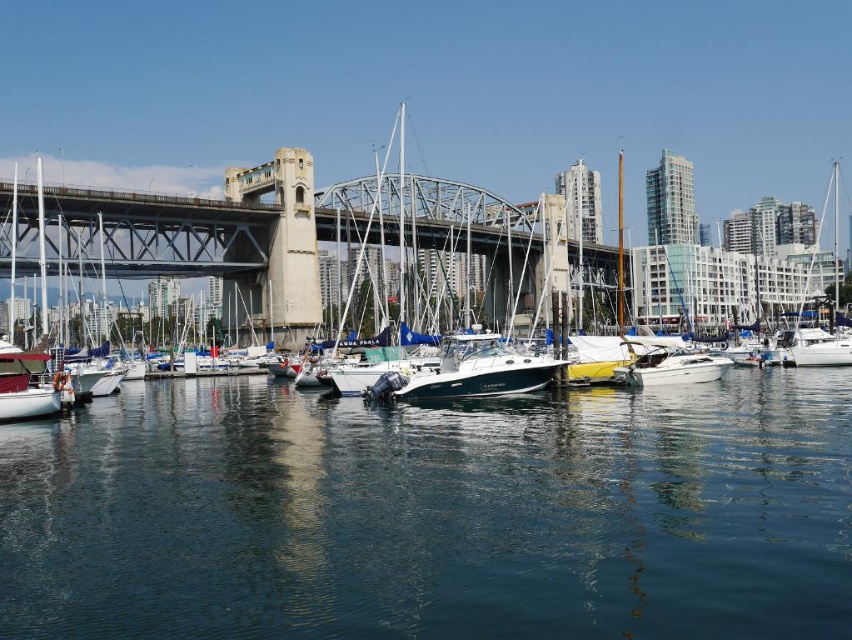
Question: Which point is farther to the camera?

Choices:
 (A) clear blue water at center
 (B) concrete bridge at center

Answer: (B)

Question: Is white matte sailboat at center positioned in front of shiny blue boat at center?

Choices:
 (A) no
 (B) yes

Answer: (A)

Question: Which of the following is the farthest from the observer?

Choices:
 (A) (124, 250)
 (B) (458, 381)
 (C) (562, 216)

Answer: (C)

Question: Can you confirm if concrete bridge at center is thinner than white matte sailboat at lower left?

Choices:
 (A) yes
 (B) no

Answer: (B)

Question: Does clear blue water at center have a greater width compared to white matte sailboat at lower left?

Choices:
 (A) no
 (B) yes

Answer: (B)

Question: Which object appears farthest from the camera in this image?

Choices:
 (A) shiny blue boat at center
 (B) clear blue water at center
 (C) white matte sailboat at lower left

Answer: (A)